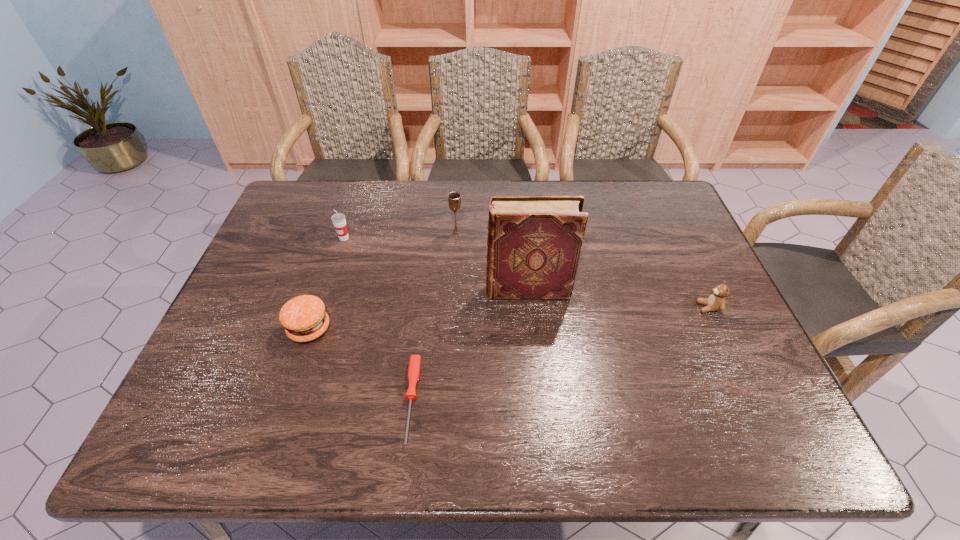
Image resolution: width=960 pixels, height=540 pixels. I want to click on vacant area located 0.330m on the spine side of the tallest object, so click(x=363, y=290).

What are the coordinates of `blank area located 0.100m on the spine side of the tallest object` in the screenshot? It's located at (448, 290).

The width and height of the screenshot is (960, 540). In order to click on vacant space located 0.240m on the back of the fifth shortest object in this screenshot , I will do `click(459, 184)`.

Where is `vacant space located on the side of the fourth shortest object with the logo`? vacant space located on the side of the fourth shortest object with the logo is located at coordinates (328, 287).

This screenshot has width=960, height=540. Identify the location of vacant space located on the front-facing side of the rightmost object. (597, 307).

This screenshot has width=960, height=540. Identify the location of free space located on the front-facing side of the rightmost object. (582, 307).

Where is `vacant space located on the front-facing side of the rightmost object`? The height and width of the screenshot is (540, 960). vacant space located on the front-facing side of the rightmost object is located at coordinates (679, 307).

Find the location of `free space located on the front of the patty`. free space located on the front of the patty is located at coordinates (280, 417).

Find the location of a particular element. This screenshot has height=540, width=960. object situated at the near edge is located at coordinates (414, 367).

Find the location of `object at the right edge`. object at the right edge is located at coordinates (716, 301).